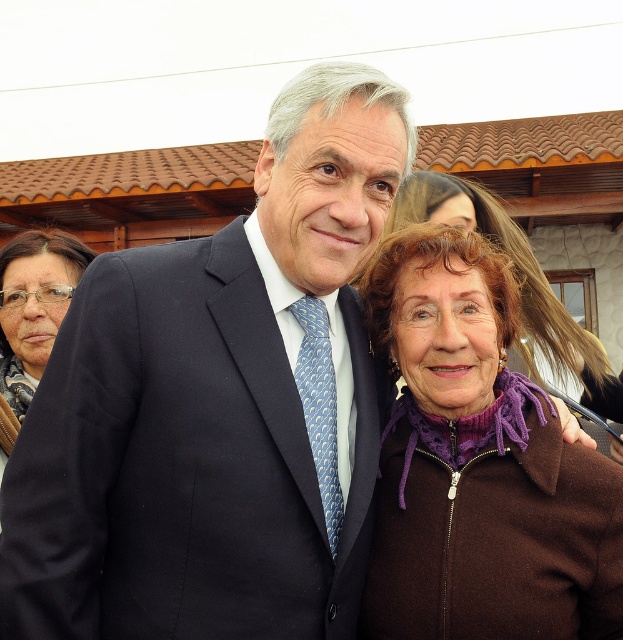
Which of these two, purple fleece at right or blue silk tie at center, stands taller?

Standing taller between the two is purple fleece at right.

The image size is (623, 640). I want to click on purple fleece at right, so click(x=477, y=465).

Identify the location of purple fleece at right. The height and width of the screenshot is (640, 623). (477, 465).

From the picture: Is purple fleece jacket at lower right positioned before blue silk tie at center?

No, it is not.

Can you confirm if purple fleece jacket at lower right is positioned below blue silk tie at center?

Incorrect, purple fleece jacket at lower right is not positioned below blue silk tie at center.

Find the location of `purple fleece jacket at lower right`. purple fleece jacket at lower right is located at coordinates (473, 227).

Which is in front, point (188, 540) or point (340, 512)?

Point (188, 540)

Locate an element on the screen. The height and width of the screenshot is (640, 623). dark blue suit at center is located at coordinates (181, 461).